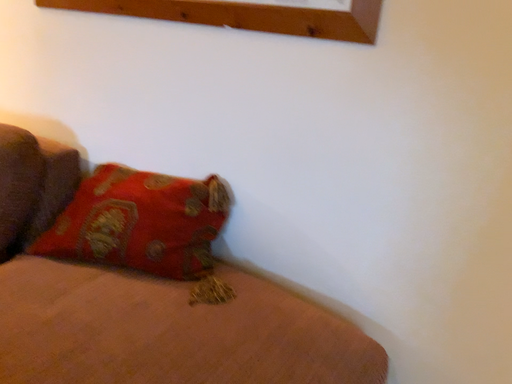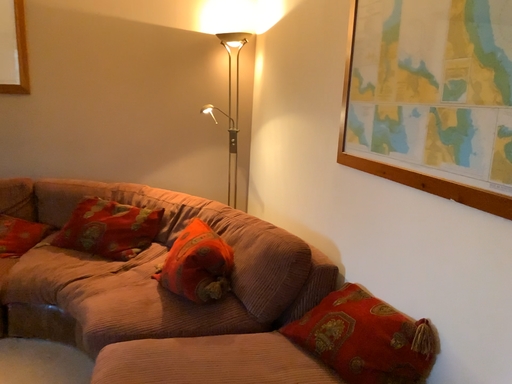
Question: Which way did the camera rotate in the video?

Choices:
 (A) rotated left
 (B) rotated right

Answer: (A)